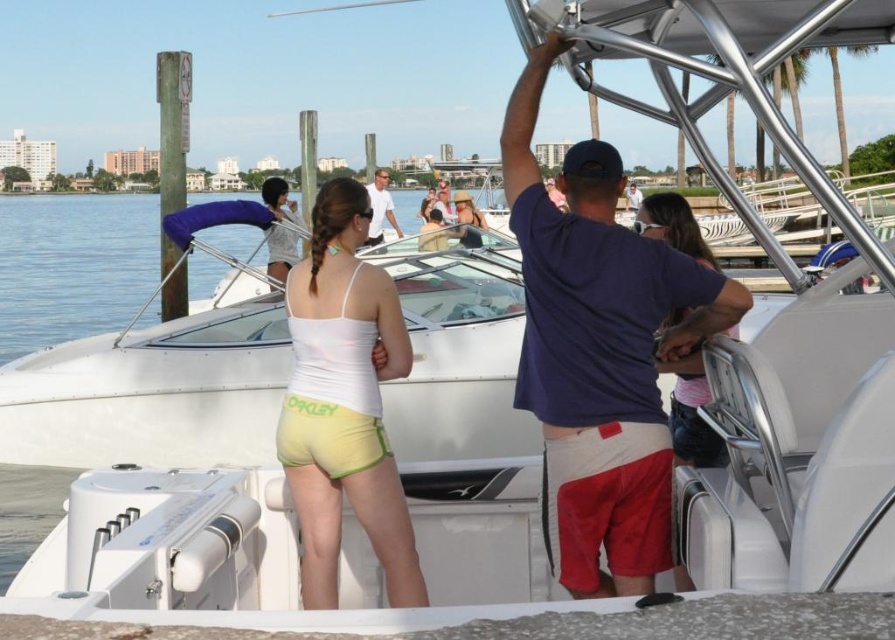
You are on a boat at a marina and see two people wearing tops. One is wearing a matte white blouse at center and the other a matte yellow bikini top at center. Which one is positioned to the left?

The matte white blouse at center is positioned to the left of the matte yellow bikini top at center.

You are a photographer taking a picture of the scene on the boat. You notice the pink fabric shirt at center and the matte beige sunglasses at center. Which object should you focus on to ensure the other is not fully visible in the photo?

The pink fabric shirt at center is in front of the matte beige sunglasses at center, so focusing on the pink fabric shirt at center will obscure the matte beige sunglasses at center, making it less visible in the photo.

You are a photographer trying to capture a closeup of the pink fabric shirt at center and the matte beige sunglasses at center. Since both are at the center, which object should you zoom in on first to ensure it fits in the frame?

The pink fabric shirt at center has a smaller size compared to matte beige sunglasses at center, so you should zoom in on the pink fabric shirt at center first to ensure it fits in the frame before adjusting for the larger matte beige sunglasses at center.